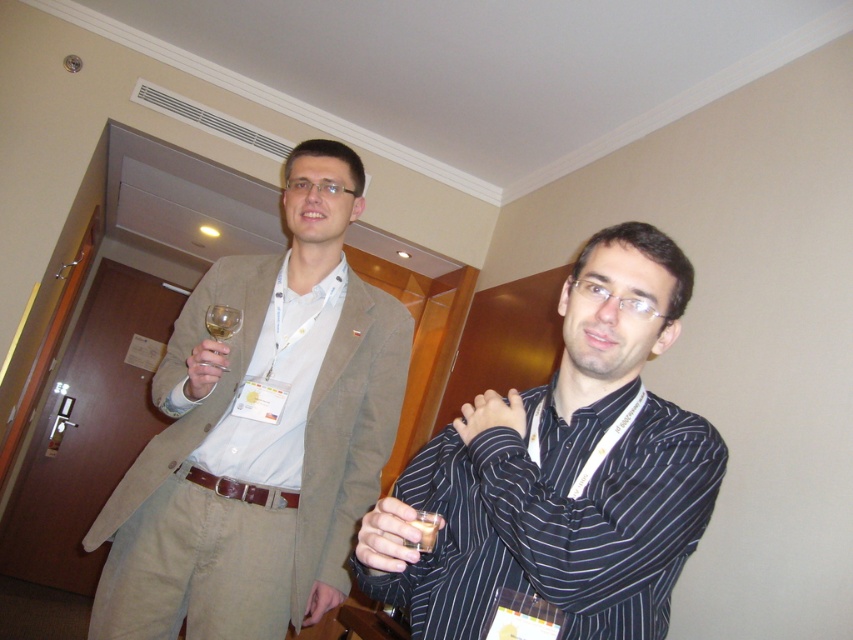
You are at a formal event and need to determine which of the two points, point (190, 355) or point (421, 518), is closer to you. Which one is nearer?

Point (190, 355) is closer to you than point (421, 518) because it is further to the viewer.

You are at a conference and want to approach the two people standing in the scene. You need to decide which point to walk towards first based on their positions. Which point should you head to first, point (286, 353) or point (434, 532)?

You should head towards point (286, 353) first because it is closer to you than point (434, 532), as it is further away.